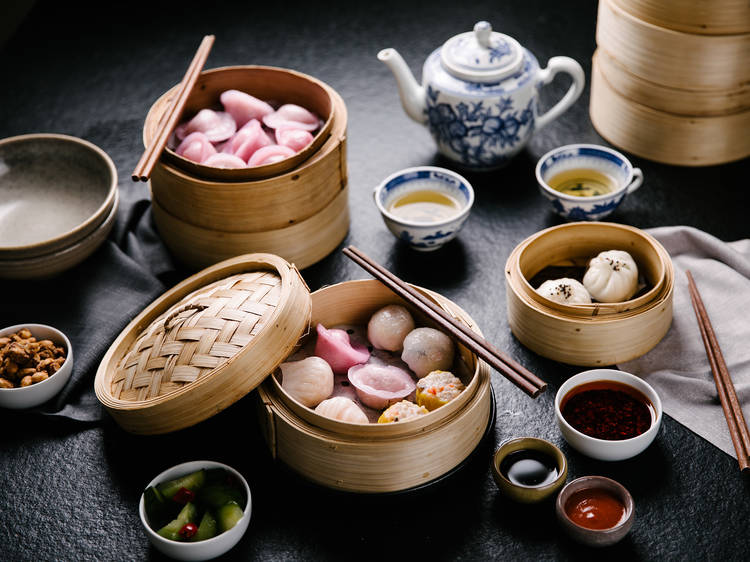
Find the location of `tea cup`. tea cup is located at coordinates (604, 199), (436, 231).